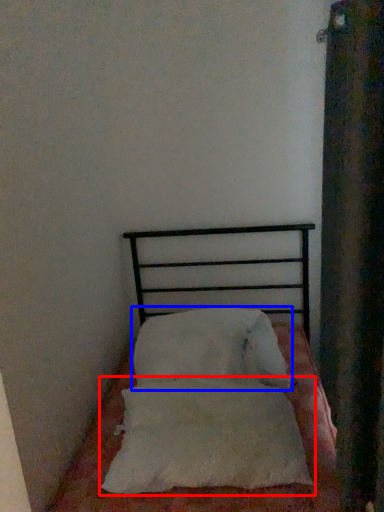
Question: Which point is closer to the camera, pillow (highlighted by a red box) or pillow (highlighted by a blue box)?

Choices:
 (A) pillow
 (B) pillow

Answer: (A)